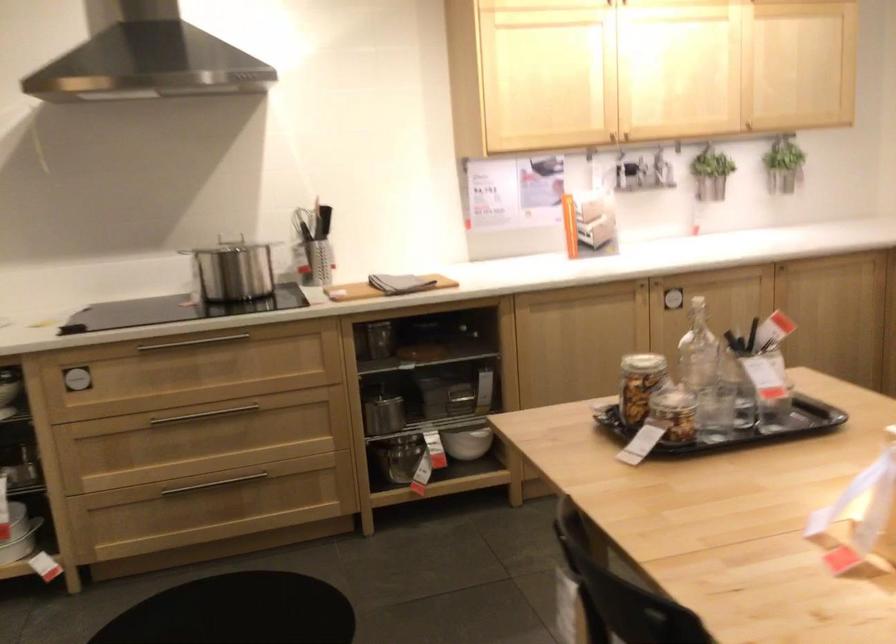
The image size is (896, 644). Identify the location of glass food jar. (640, 384).